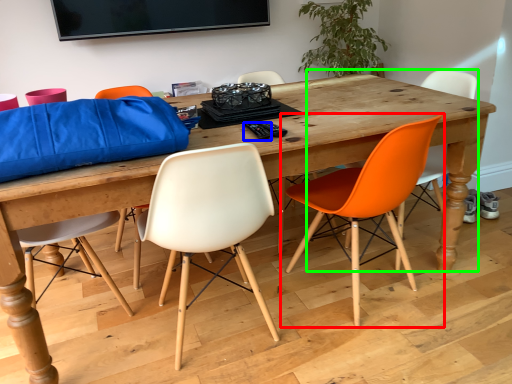
Question: Which is nearer to the chair (highlighted by a red box)? remote control (highlighted by a blue box) or chair (highlighted by a green box).

Choices:
 (A) remote control
 (B) chair

Answer: (A)